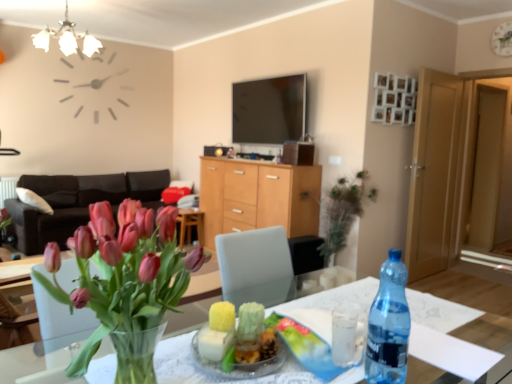
Question: Considering the relative positions of clear glass vase at center and light brown wooden door at right, marked as the first glass door in a left-to-right arrangement, in the image provided, is clear glass vase at center behind light brown wooden door at right, marked as the first glass door in a left-to-right arrangement,?

Choices:
 (A) yes
 (B) no

Answer: (B)

Question: From the image's perspective, does clear glass vase at center appear lower than light brown wooden door at right, the 2th glass door viewed from the right?

Choices:
 (A) yes
 (B) no

Answer: (A)

Question: Considering the relative sizes of clear glass vase at center and light brown wooden door at right, the 2th glass door viewed from the right, in the image provided, is clear glass vase at center thinner than light brown wooden door at right, the 2th glass door viewed from the right,?

Choices:
 (A) no
 (B) yes

Answer: (A)

Question: From the image's perspective, is clear glass vase at center on top of light brown wooden door at right, marked as the first glass door in a left-to-right arrangement?

Choices:
 (A) no
 (B) yes

Answer: (A)

Question: Considering the relative sizes of clear glass vase at center and light brown wooden door at right, marked as the first glass door in a left-to-right arrangement, in the image provided, is clear glass vase at center bigger than light brown wooden door at right, marked as the first glass door in a left-to-right arrangement,?

Choices:
 (A) yes
 (B) no

Answer: (A)

Question: Is wooden cabinet at center to the left or to the right of matte black phone at center in the image?

Choices:
 (A) right
 (B) left

Answer: (A)

Question: Considering their positions, is wooden cabinet at center located in front of or behind matte black phone at center?

Choices:
 (A) front
 (B) behind

Answer: (A)

Question: In terms of width, does wooden cabinet at center look wider or thinner when compared to matte black phone at center?

Choices:
 (A) wide
 (B) thin

Answer: (A)

Question: Is wooden cabinet at center inside the boundaries of matte black phone at center, or outside?

Choices:
 (A) inside
 (B) outside

Answer: (B)

Question: Is point (406, 311) positioned closer to the camera than point (205, 152)?

Choices:
 (A) closer
 (B) farther

Answer: (A)

Question: Based on their sizes in the image, would you say transparent plastic bottle at table right is bigger or smaller than matte black phone at center?

Choices:
 (A) big
 (B) small

Answer: (B)

Question: Would you say transparent plastic bottle at table right is to the left or to the right of matte black phone at center in the picture?

Choices:
 (A) left
 (B) right

Answer: (B)

Question: Considering their positions, is transparent plastic bottle at table right located in front of or behind matte black phone at center?

Choices:
 (A) front
 (B) behind

Answer: (A)

Question: In the image, is light brown wooden door at right, marked as the first glass door in a left-to-right arrangement, on the left side or the right side of white glass chandelier at upper left?

Choices:
 (A) right
 (B) left

Answer: (A)

Question: Looking at their shapes, would you say light brown wooden door at right, the 2th glass door viewed from the right, is wider or thinner than white glass chandelier at upper left?

Choices:
 (A) thin
 (B) wide

Answer: (A)